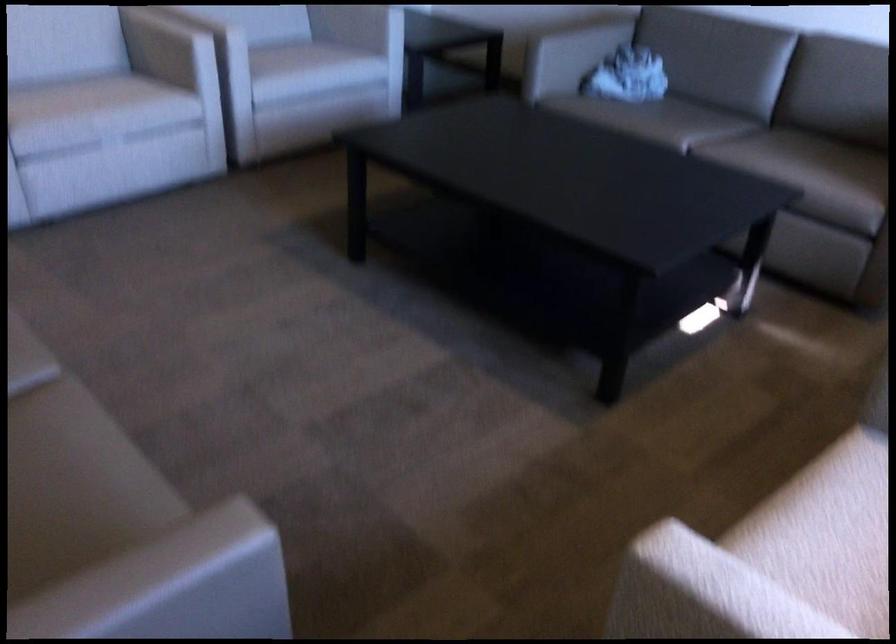
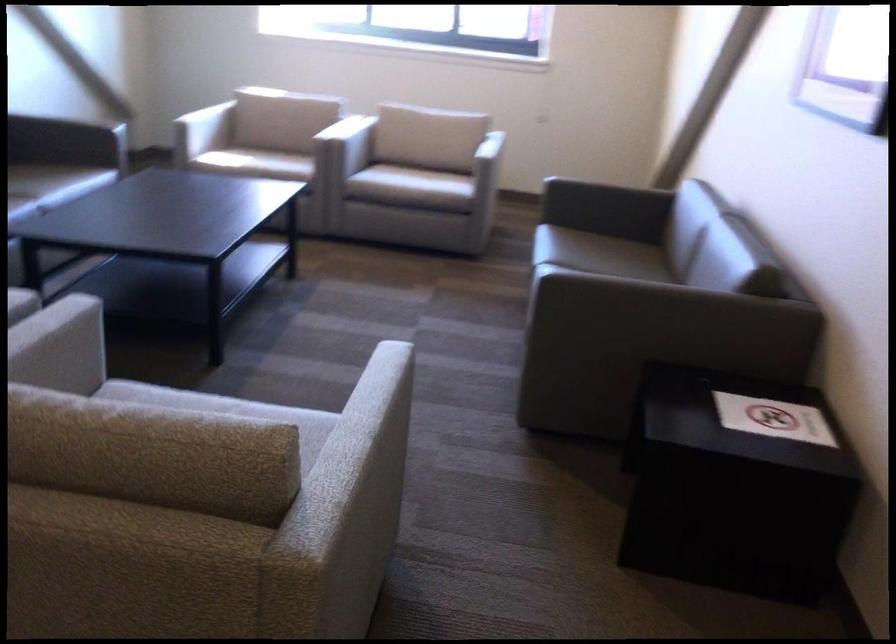
In the second image, find the point that corresponds to [355,393] in the first image.

(352, 330)